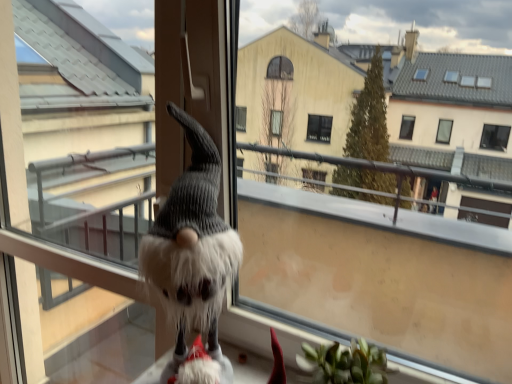
Question: Is fuzzy gray screen door at center to the left or to the right of fluffy white gnome at center in the image?

Choices:
 (A) left
 (B) right

Answer: (A)

Question: From the image's perspective, is fuzzy gray screen door at center above or below fluffy white gnome at center?

Choices:
 (A) above
 (B) below

Answer: (B)

Question: Based on their relative distances, which object is nearer to the fluffy white gnome at center?

Choices:
 (A) fuzzy fabric gnome at lower left
 (B) fuzzy gray screen door at center

Answer: (B)

Question: Estimate the real-world distances between objects in this image. Which object is farther from the fuzzy fabric gnome at lower left?

Choices:
 (A) fluffy white gnome at center
 (B) fuzzy gray screen door at center

Answer: (A)